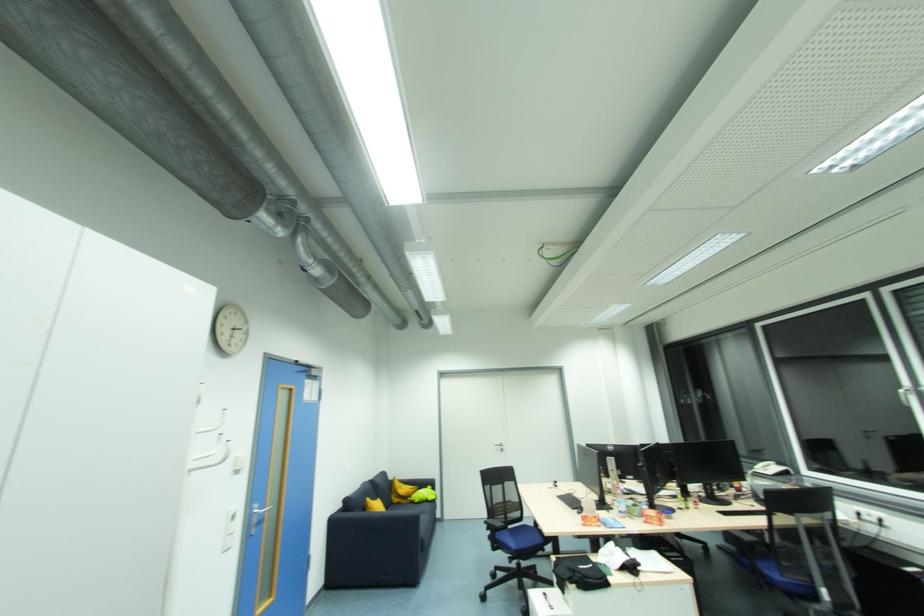
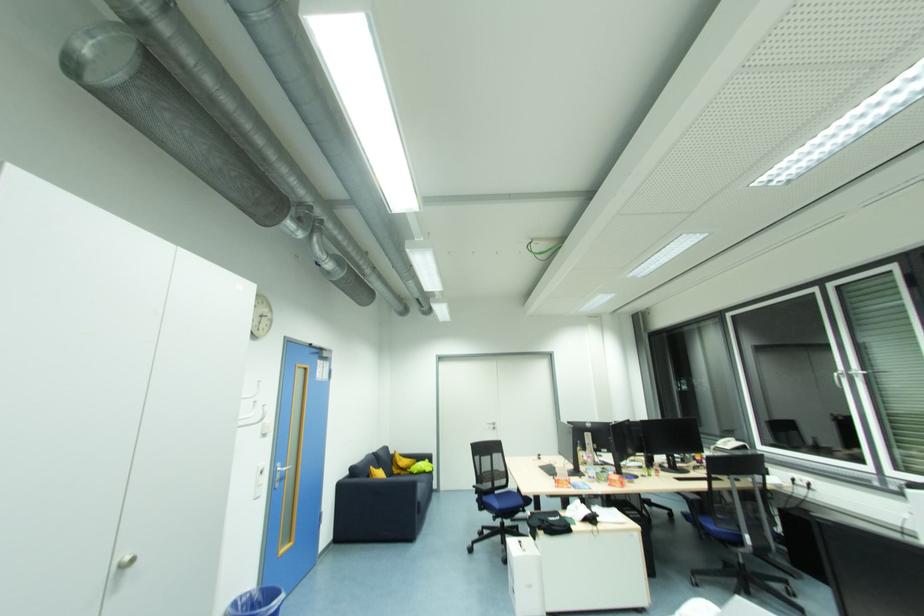
Find the pixel in the second image that matches point 516,485 in the first image.

(504, 456)